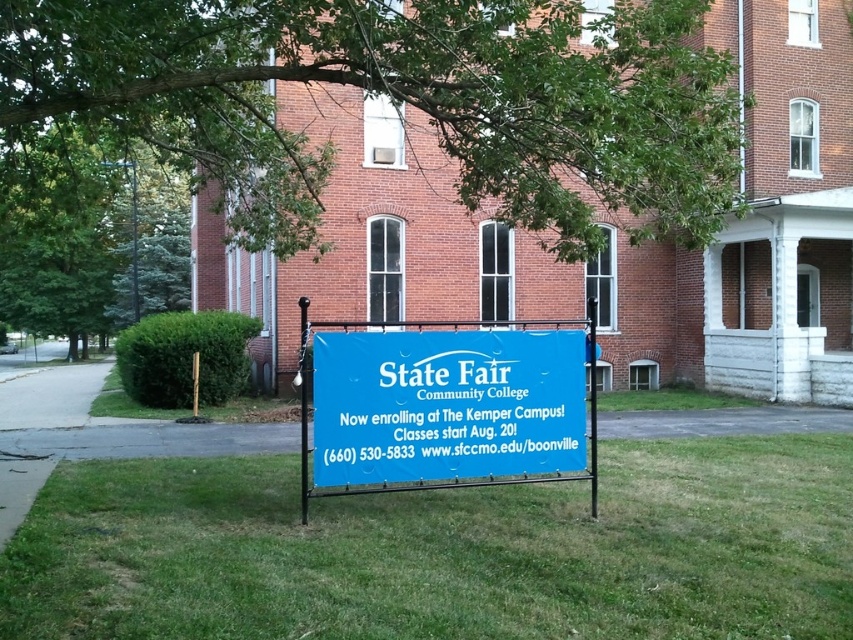
Where is `green grass at center`? green grass at center is located at coordinates (444, 550).

Locate an element on the screen. This screenshot has height=640, width=853. green grass at center is located at coordinates (444, 550).